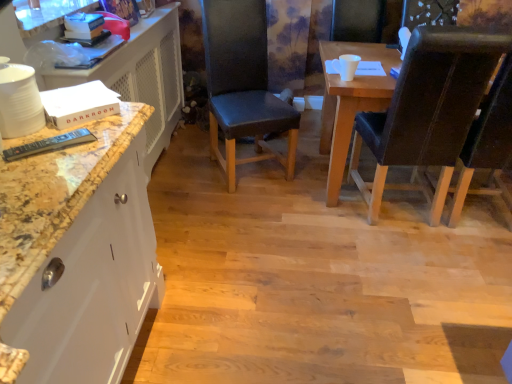
Question: Considering the positions of dark brown leather chair at right, arranged as the 3th chair when viewed from the left, and black leather chair at center, the third chair from the right, in the image, is dark brown leather chair at right, arranged as the 3th chair when viewed from the left, bigger or smaller than black leather chair at center, the third chair from the right,?

Choices:
 (A) small
 (B) big

Answer: (B)

Question: In terms of height, does dark brown leather chair at right, arranged as the 3th chair when viewed from the left, look taller or shorter compared to black leather chair at center, the third chair from the right?

Choices:
 (A) tall
 (B) short

Answer: (A)

Question: Estimate the real-world distances between objects in this image. Which object is closer to the black leather chair at center, the third chair from the right?

Choices:
 (A) black leather chair at right, which is the second chair in right-to-left order
 (B) dark brown leather chair at right, arranged as the 3th chair when viewed from the left
 (C) marble/dark brown dresser at left

Answer: (C)

Question: Which of these objects is positioned closest to the dark brown leather chair at right, arranged as the 3th chair when viewed from the left?

Choices:
 (A) marble/dark brown dresser at left
 (B) black leather chair at center, the third chair from the right
 (C) black leather chair at right, which is the second chair in right-to-left order

Answer: (C)